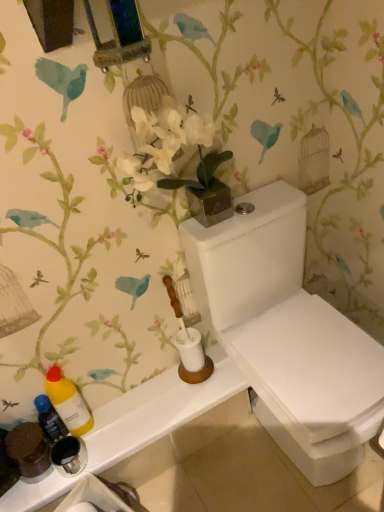
This screenshot has height=512, width=384. I want to click on vacant area that is in front of translucent plastic bottle at lower left, positioned as the 1th bottle in left-to-right order, so click(47, 484).